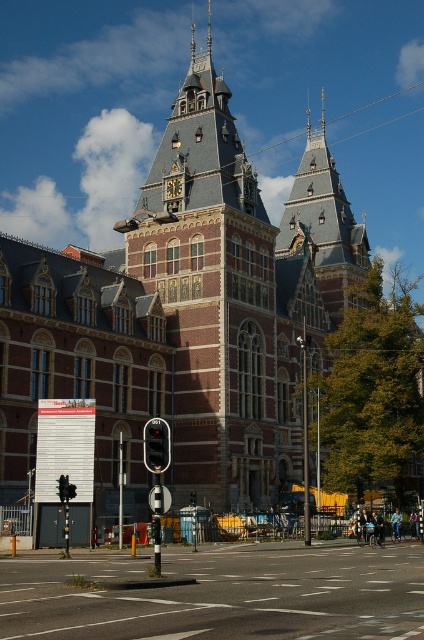
Question: Which of the following is the closest to the observer?

Choices:
 (A) black glass traffic light at center
 (B) red brick tower at center

Answer: (A)

Question: Estimate the real-world distances between objects in this image. Which object is farther from the smooth asphalt road at center?

Choices:
 (A) red brick tower at center
 (B) black glass traffic light at center

Answer: (A)

Question: Is smooth asphalt road at center below black glass traffic light at center?

Choices:
 (A) no
 (B) yes

Answer: (B)

Question: Is smooth asphalt road at center further to the viewer compared to black glass traffic light at center?

Choices:
 (A) no
 (B) yes

Answer: (A)

Question: Which object appears farthest from the camera in this image?

Choices:
 (A) red brick tower at center
 (B) black glass traffic light at center
 (C) smooth asphalt road at center

Answer: (A)

Question: Is smooth asphalt road at center below black glass traffic light at center?

Choices:
 (A) yes
 (B) no

Answer: (A)